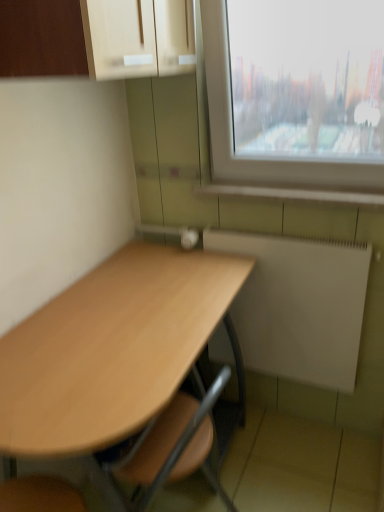
Question: From a real-world perspective, is light brown wood desk at center positioned under white matte radiator at lower right based on gravity?

Choices:
 (A) yes
 (B) no

Answer: (A)

Question: From the image's perspective, is light brown wood desk at center on top of white matte radiator at lower right?

Choices:
 (A) yes
 (B) no

Answer: (B)

Question: Is light brown wood desk at center behind white matte radiator at lower right?

Choices:
 (A) yes
 (B) no

Answer: (B)

Question: Is light brown wood desk at center closer to the viewer compared to white matte radiator at lower right?

Choices:
 (A) yes
 (B) no

Answer: (A)

Question: Does light brown wood desk at center have a smaller size compared to white matte radiator at lower right?

Choices:
 (A) no
 (B) yes

Answer: (A)

Question: From the image's perspective, does light brown wood desk at center appear lower than white matte radiator at lower right?

Choices:
 (A) yes
 (B) no

Answer: (A)

Question: Considering the relative sizes of matte wood cabinet at upper left and white matte radiator at lower right in the image provided, is matte wood cabinet at upper left shorter than white matte radiator at lower right?

Choices:
 (A) yes
 (B) no

Answer: (A)

Question: Does matte wood cabinet at upper left have a greater width compared to white matte radiator at lower right?

Choices:
 (A) yes
 (B) no

Answer: (A)

Question: Is matte wood cabinet at upper left turned away from white matte radiator at lower right?

Choices:
 (A) no
 (B) yes

Answer: (A)

Question: Does matte wood cabinet at upper left contain white matte radiator at lower right?

Choices:
 (A) no
 (B) yes

Answer: (A)

Question: From the image's perspective, is matte wood cabinet at upper left on top of white matte radiator at lower right?

Choices:
 (A) yes
 (B) no

Answer: (A)

Question: From a real-world perspective, is matte wood cabinet at upper left physically below white matte radiator at lower right?

Choices:
 (A) yes
 (B) no

Answer: (B)

Question: Does white matte radiator at lower right appear on the left side of white tile at lower right?

Choices:
 (A) no
 (B) yes

Answer: (A)